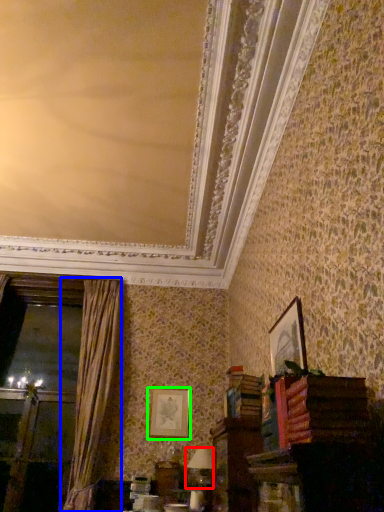
Question: Considering the real-world distances, which object is closest to table lamp (highlighted by a red box)? curtain (highlighted by a blue box) or picture frame (highlighted by a green box).

Choices:
 (A) curtain
 (B) picture frame

Answer: (B)